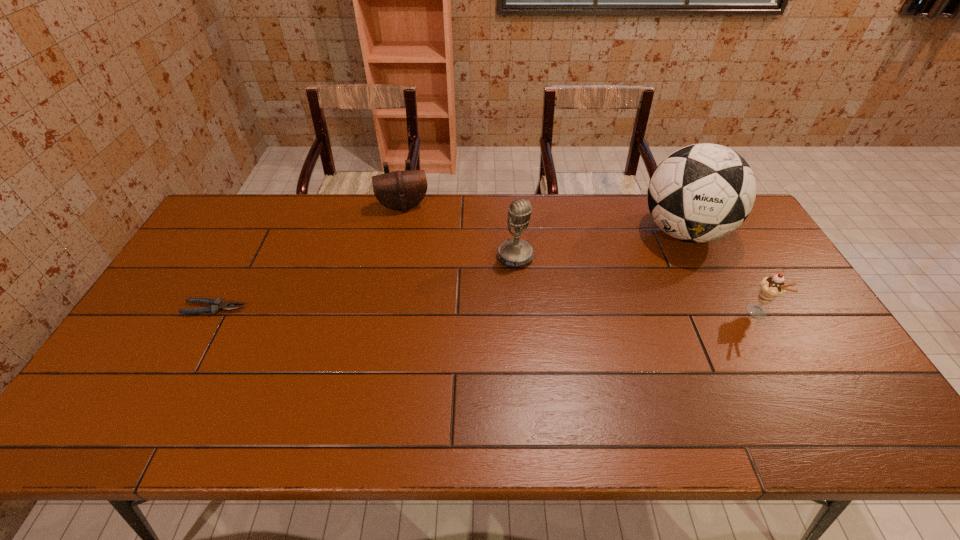
The width and height of the screenshot is (960, 540). I want to click on unoccupied position between the third object from left to right and the tallest object, so click(599, 244).

Locate an element on the screen. The image size is (960, 540). vacant area that lies between the pouch and the soccer ball is located at coordinates (543, 219).

Where is `unoccupied position between the icecream and the leftmost object`? This screenshot has height=540, width=960. unoccupied position between the icecream and the leftmost object is located at coordinates (486, 311).

The width and height of the screenshot is (960, 540). In order to click on free space between the leftmost object and the second tallest object in this screenshot , I will do `click(365, 282)`.

This screenshot has height=540, width=960. What are the coordinates of `unoccupied area between the tallest object and the leftmost object` in the screenshot? It's located at (449, 270).

Where is `vacant space that is in between the leftmost object and the icecream`? vacant space that is in between the leftmost object and the icecream is located at coordinates (486, 311).

This screenshot has height=540, width=960. Identify the location of vacant point located between the icecream and the fourth shortest object. (636, 285).

Locate an element on the screen. free space between the fourth shortest object and the fourth object from right to left is located at coordinates (459, 231).

Locate an element on the screen. free spot between the pouch and the tallest object is located at coordinates (543, 219).

The height and width of the screenshot is (540, 960). Identify the location of the fourth closest object to the icecream. (217, 304).